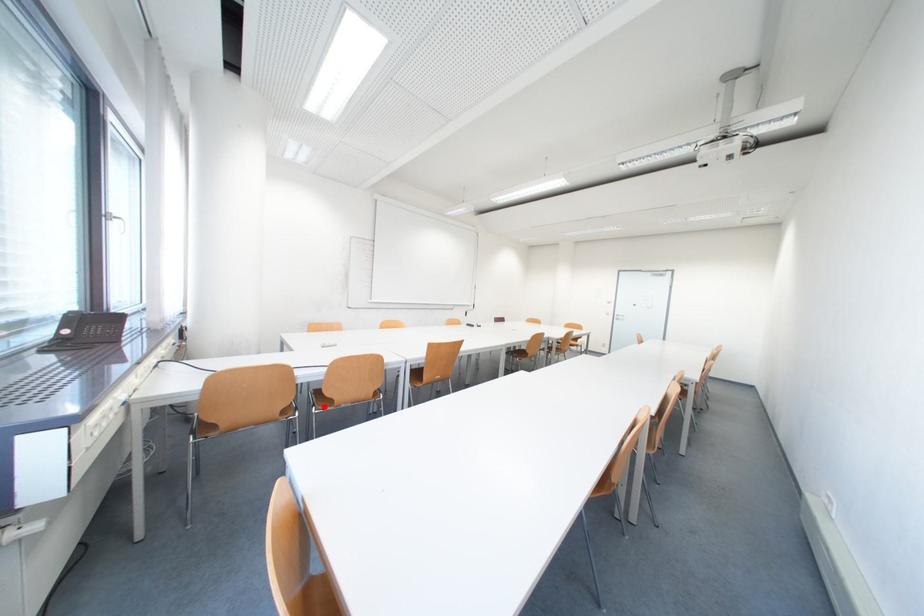
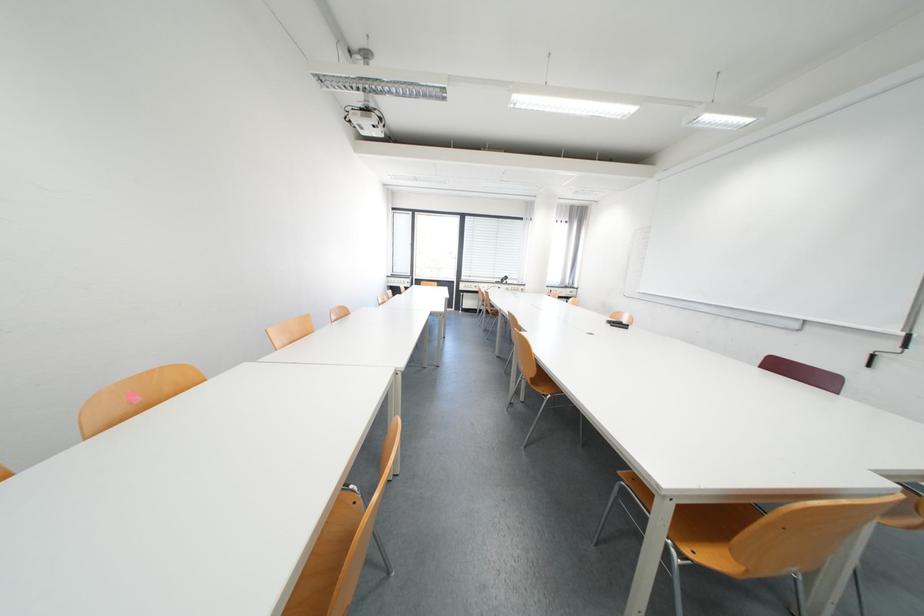
Question: I am providing you with two images of the same scene from different viewpoints. A red point is marked on the first image. Is the red point's position out of view in image 2?

Choices:
 (A) Yes
 (B) No

Answer: (A)